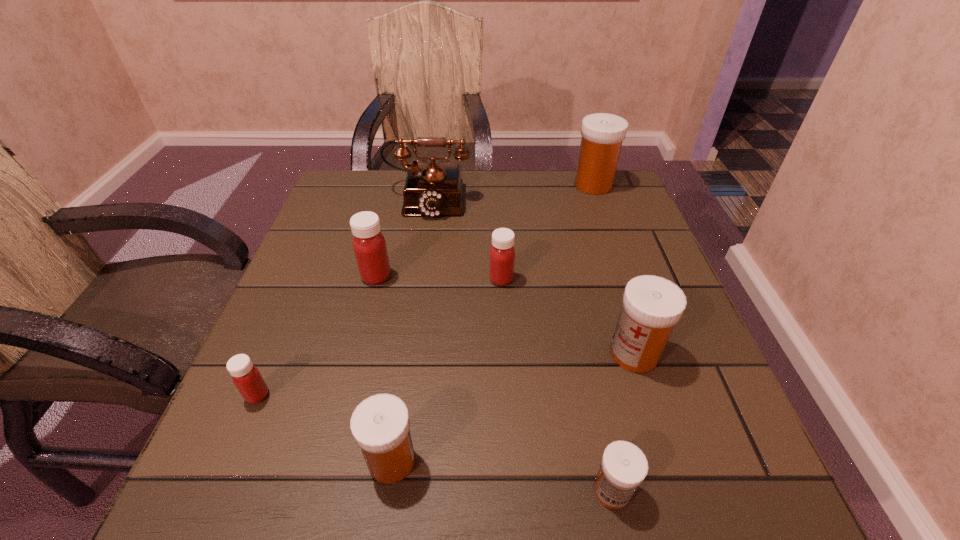
Locate which red medicine ranks in proximity to the third medicine from right to left. Please provide its 2D coordinates. Your answer should be formatted as a tuple, i.e. [(x, y)], where the tuple contains the x and y coordinates of a point satisfying the conditions above.

[(502, 253)]

Image resolution: width=960 pixels, height=540 pixels. Find the location of `vacant space that satisfies the following two spatial constraints: 1. on the dial of the brown telephone; 2. on the right side of the sixth object from left to right`. vacant space that satisfies the following two spatial constraints: 1. on the dial of the brown telephone; 2. on the right side of the sixth object from left to right is located at coordinates (383, 491).

This screenshot has width=960, height=540. I want to click on vacant area that satisfies the following two spatial constraints: 1. on the back side of the rightmost red medicine; 2. on the left side of the biggest white medicine, so click(x=496, y=185).

In order to click on vacant region that satisfies the following two spatial constraints: 1. on the dial of the brown telephone; 2. on the left side of the third medicine from left to right in this screenshot , I will do `click(388, 461)`.

Locate an element on the screen. blank area in the image that satisfies the following two spatial constraints: 1. on the front side of the fourth nearest object; 2. on the right side of the second biggest red medicine is located at coordinates (505, 354).

Locate an element on the screen. Image resolution: width=960 pixels, height=540 pixels. free space that satisfies the following two spatial constraints: 1. on the dial of the brown telephone; 2. on the right side of the third white medicine from right to left is located at coordinates (383, 491).

This screenshot has width=960, height=540. What are the coordinates of `blank area in the image that satisfies the following two spatial constraints: 1. on the front side of the leftmost white medicine; 2. on the right side of the third medicine from right to left` in the screenshot? It's located at (387, 491).